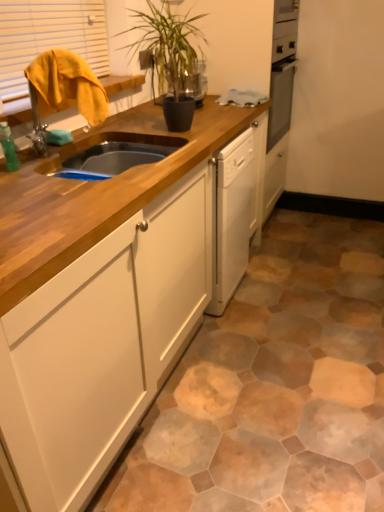
Locate an element on the screen. This screenshot has width=384, height=512. green matte bottle at left is located at coordinates (8, 147).

What do you see at coordinates (100, 297) in the screenshot?
I see `wooden cabinet at center` at bounding box center [100, 297].

Where is `green leafy plant at upper center`? green leafy plant at upper center is located at coordinates (166, 42).

Image resolution: width=384 pixels, height=512 pixels. In order to click on yellow fabric at upper left in this screenshot , I will do `click(48, 37)`.

Find the location of a particular element. green matte bottle at left is located at coordinates (8, 147).

From a real-world perspective, who is located lower, green leafy plant at upper center or green matte bottle at left?

From a 3D spatial view, green matte bottle at left is below.

Is point (153, 64) closer or farther from the camera than point (5, 135)?

Point (153, 64) is farther from the camera than point (5, 135).

Looking at this image, is green leafy plant at upper center wider or thinner than green matte bottle at left?

Considering their sizes, green leafy plant at upper center looks broader than green matte bottle at left.

At what (x,y) coordinates should I click in order to perform the action: click on bottle below the green leafy plant at upper center (from the image's perspective). Please return your answer as a coordinate pair (x, y). This screenshot has width=384, height=512. Looking at the image, I should click on (8, 147).

Is green matte bottle at left further to the viewer compared to green leafy plant at upper center?

No, the depth of green matte bottle at left is less than that of green leafy plant at upper center.

Which is more to the right, green matte bottle at left or green leafy plant at upper center?

Positioned to the right is green leafy plant at upper center.

Is green matte bottle at left positioned with its back to green leafy plant at upper center?

No, green leafy plant at upper center is not at the back of green matte bottle at left.

Is yellow fabric at upper left in front of or behind wooden cabinet at center in the image?

yellow fabric at upper left is behind wooden cabinet at center.

Based on the photo, is yellow fabric at upper left far away from wooden cabinet at center?

No, yellow fabric at upper left is not far away from wooden cabinet at center.

Is yellow fabric at upper left positioned with its back to wooden cabinet at center?

No, yellow fabric at upper left is not facing away from wooden cabinet at center.

The image size is (384, 512). What are the coordinates of `bottle lying on the left of yellow fabric at upper left` in the screenshot? It's located at (8, 147).

From the image's perspective, between green matte bottle at left and yellow fabric at upper left, which one is located above?

From the image's view, yellow fabric at upper left is above.

From a real-world perspective, does green matte bottle at left stand above yellow fabric at upper left?

No.

Does green matte bottle at left have a greater height compared to yellow fabric at upper left?

No, green matte bottle at left is not taller than yellow fabric at upper left.

Which is more distant, [77,33] or [5,144]?

The point [77,33] is behind.

Considering the sizes of objects yellow fabric at upper left and green matte bottle at left in the image provided, who is taller, yellow fabric at upper left or green matte bottle at left?

Standing taller between the two is yellow fabric at upper left.

Is yellow fabric at upper left positioned far away from green matte bottle at left?

No, yellow fabric at upper left is in close proximity to green matte bottle at left.

Considering the relative sizes of yellow fabric at upper left and green matte bottle at left in the image provided, is yellow fabric at upper left bigger than green matte bottle at left?

Correct, yellow fabric at upper left is larger in size than green matte bottle at left.

From a real-world perspective, is wooden cabinet at center positioned under yellow fabric at upper left based on gravity?

Yes, from a real-world perspective, wooden cabinet at center is beneath yellow fabric at upper left.

Find the location of a particular element. The height and width of the screenshot is (512, 384). cabinetry in front of the yellow fabric at upper left is located at coordinates tap(100, 297).

Considering the relative positions of wooden cabinet at center and yellow fabric at upper left in the image provided, is wooden cabinet at center to the right of yellow fabric at upper left from the viewer's perspective?

Correct, you'll find wooden cabinet at center to the right of yellow fabric at upper left.

Which object is positioned more to the right, yellow fabric at upper left or green leafy plant at upper center?

From the viewer's perspective, green leafy plant at upper center appears more on the right side.

In terms of height, does yellow fabric at upper left look taller or shorter compared to green leafy plant at upper center?

In the image, yellow fabric at upper left appears to be shorter than green leafy plant at upper center.

Is yellow fabric at upper left behind green leafy plant at upper center?

Yes, it is behind green leafy plant at upper center.

From a real-world perspective, is yellow fabric at upper left on green leafy plant at upper center?

Indeed, from a real-world perspective, yellow fabric at upper left stands above green leafy plant at upper center.

Find the location of a particular element. This screenshot has width=384, height=512. houseplant on the right of green matte bottle at left is located at coordinates (166, 42).

Locate an element on the screen. The image size is (384, 512). bottle below the green leafy plant at upper center (from a real-world perspective) is located at coordinates (8, 147).

Looking at the image, which one is located further to green leafy plant at upper center, yellow fabric at upper left or green matte bottle at left?

Among the two, green matte bottle at left is located further to green leafy plant at upper center.

Estimate the real-world distances between objects in this image. Which object is closer to wooden cabinet at center, green matte bottle at left or green leafy plant at upper center?

green matte bottle at left lies closer to wooden cabinet at center than the other object.

Looking at the image, which one is located further to yellow fabric at upper left, wooden cabinet at center or green matte bottle at left?

Among the two, wooden cabinet at center is located further to yellow fabric at upper left.

Which object lies further to the anchor point yellow fabric at upper left, green leafy plant at upper center or green matte bottle at left?

green matte bottle at left.

Considering their positions, is yellow fabric at upper left positioned closer to green leafy plant at upper center than wooden cabinet at center?

The object closer to green leafy plant at upper center is yellow fabric at upper left.

When comparing their distances from wooden cabinet at center, does yellow fabric at upper left or green matte bottle at left seem closer?

Based on the image, green matte bottle at left appears to be nearer to wooden cabinet at center.

When comparing their distances from green matte bottle at left, does yellow fabric at upper left or wooden cabinet at center seem further?

yellow fabric at upper left.

From the picture: Estimate the real-world distances between objects in this image. Which object is further from green matte bottle at left, wooden cabinet at center or yellow fabric at upper left?

yellow fabric at upper left.

This screenshot has height=512, width=384. I want to click on bottle that lies between yellow fabric at upper left and wooden cabinet at center from top to bottom, so click(8, 147).

The width and height of the screenshot is (384, 512). In order to click on houseplant that lies between yellow fabric at upper left and wooden cabinet at center from top to bottom in this screenshot , I will do `click(166, 42)`.

Locate an element on the screen. This screenshot has height=512, width=384. houseplant between yellow fabric at upper left and green matte bottle at left in the up-down direction is located at coordinates (166, 42).

Image resolution: width=384 pixels, height=512 pixels. I want to click on bottle between wooden cabinet at center and green leafy plant at upper center in the front-back direction, so click(x=8, y=147).